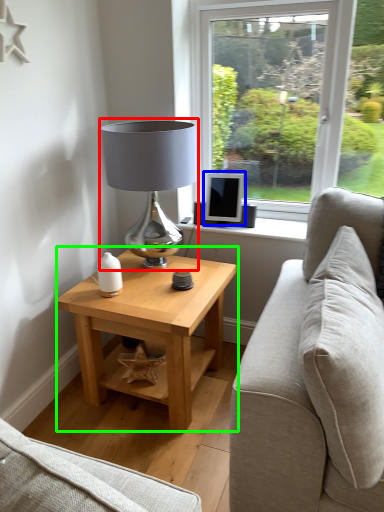
Question: Which is farther away from table lamp (highlighted by a red box)? computer monitor (highlighted by a blue box) or table (highlighted by a green box)?

Choices:
 (A) computer monitor
 (B) table

Answer: (B)